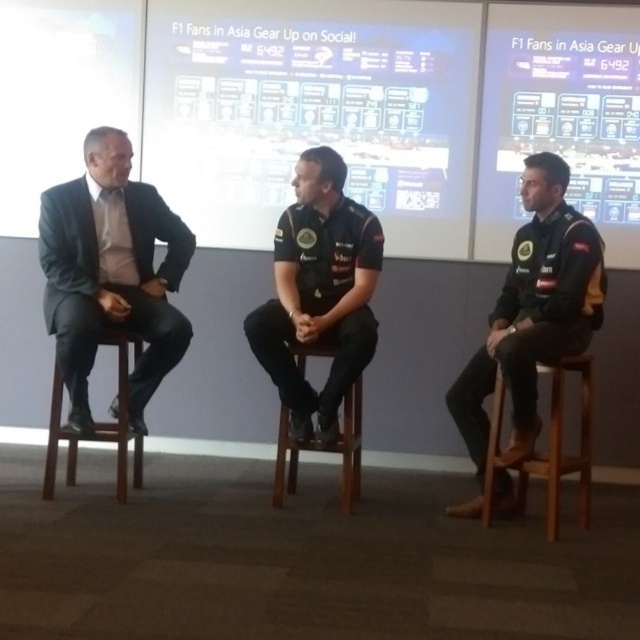
Question: Is black jersey at center in front of brown wooden stool at left?

Choices:
 (A) no
 (B) yes

Answer: (B)

Question: Is dark gray jersey at center in front of wooden stool at lower right?

Choices:
 (A) no
 (B) yes

Answer: (B)

Question: Which is farther from the white glossy projection screen at center?

Choices:
 (A) matte black screen at upper center
 (B) brown wooden stool at left
 (C) matte black suit at left
 (D) dark gray jersey at center

Answer: (B)

Question: Which of these objects is positioned closest to the wooden stool at center?

Choices:
 (A) matte black screen at upper center
 (B) matte black suit at left

Answer: (B)

Question: Which object is the farthest from the matte black screen at upper center?

Choices:
 (A) brown wooden stool at left
 (B) white glossy projection screen at center
 (C) wooden stool at lower right
 (D) dark gray jersey at center

Answer: (A)

Question: Does dark gray jersey at center come behind wooden stool at center?

Choices:
 (A) yes
 (B) no

Answer: (B)